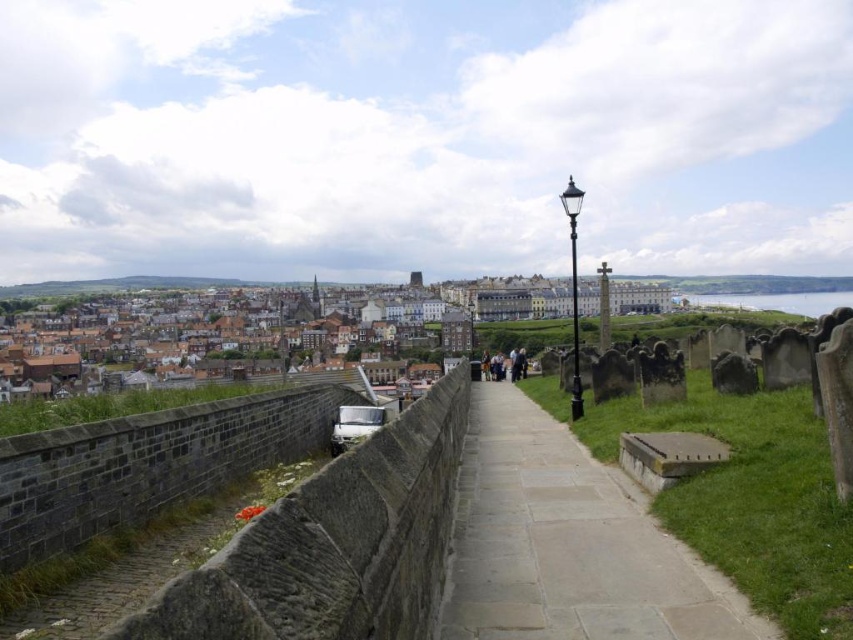
This screenshot has height=640, width=853. Identify the location of gray stone path at center. (567, 544).

Can you confirm if brown brick buildings at center is wider than dark gray stone tombstones at center?

Yes, brown brick buildings at center is wider than dark gray stone tombstones at center.

Is point (585, 314) closer to camera compared to point (430, 368)?

No, (585, 314) is behind (430, 368).

Image resolution: width=853 pixels, height=640 pixels. What are the coordinates of `brown brick buildings at center` in the screenshot? It's located at (183, 307).

Can you confirm if gray stone path at center is wider than dark gray stone tombstones at center?

No.

Can you confirm if gray stone path at center is positioned below dark gray stone tombstones at center?

Correct, gray stone path at center is located below dark gray stone tombstones at center.

Does point (705, 637) come behind point (527, 326)?

No, (705, 637) is closer to viewer.

At what (x,y) coordinates should I click in order to perform the action: click on gray stone path at center. Please return your answer as a coordinate pair (x, y). Image resolution: width=853 pixels, height=640 pixels. Looking at the image, I should click on (567, 544).